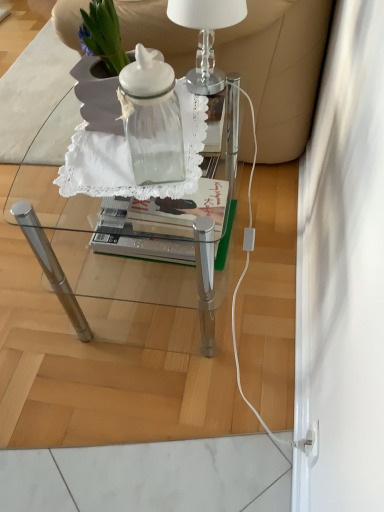
You are a GUI agent. You are given a task and a screenshot of the screen. Output one action in this format:
    pyautogui.click(x=<x>, y=<y>)
    Task: Click on the free space that is to the left of transparent glass table at center
    Image resolution: width=384 pixels, height=512 pixels.
    Given the screenshot: What is the action you would take?
    pyautogui.click(x=42, y=292)